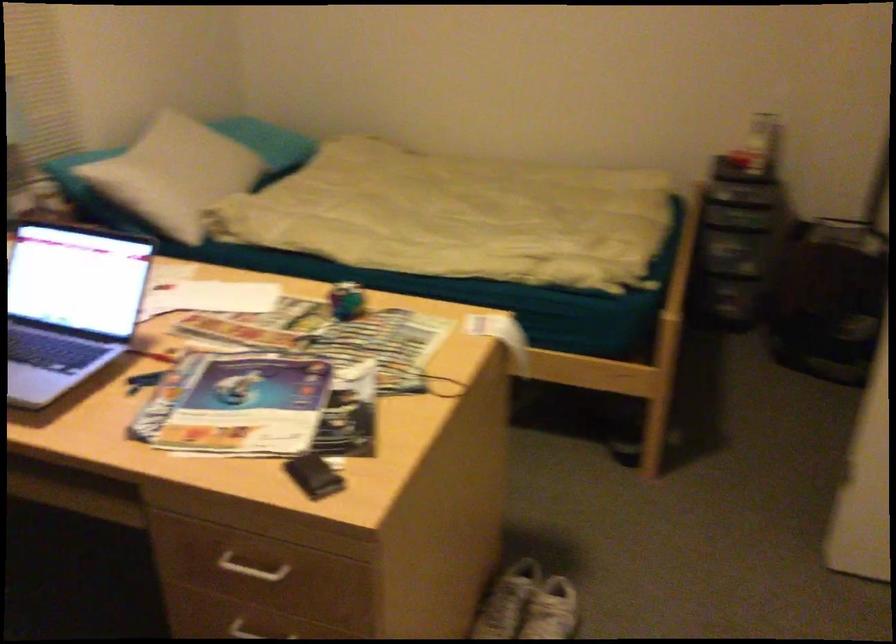
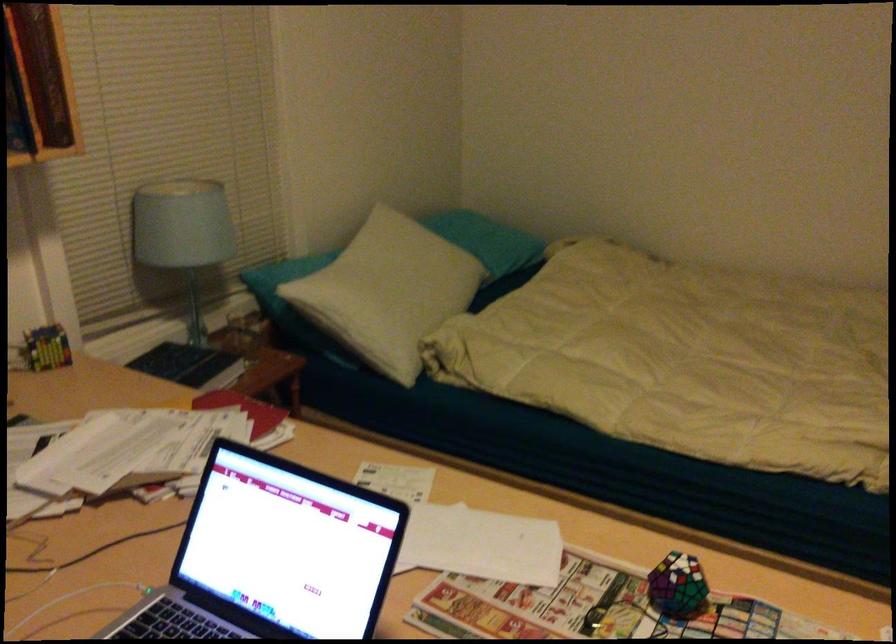
In the second image, find the point that corresponds to (177,169) in the first image.

(391, 285)